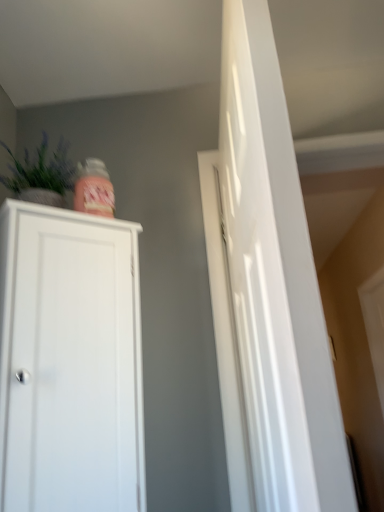
Describe the element at coordinates (41, 172) in the screenshot. I see `green matte vase at upper left` at that location.

Where is `green matte vase at upper left`? The width and height of the screenshot is (384, 512). green matte vase at upper left is located at coordinates (41, 172).

Identify the location of white matte cabinet at left. The width and height of the screenshot is (384, 512). (70, 362).

Describe the element at coordinates (70, 362) in the screenshot. The height and width of the screenshot is (512, 384). I see `white matte cabinet at left` at that location.

Image resolution: width=384 pixels, height=512 pixels. What do you see at coordinates (267, 291) in the screenshot? I see `glossy white door at right` at bounding box center [267, 291].

Identify the location of green matte vase at upper left. The image size is (384, 512). (41, 172).

Is white matte cabinet at left next to glossy white door at right and touching it?

No, white matte cabinet at left is not touching glossy white door at right.

From the picture: Can you confirm if white matte cabinet at left is smaller than glossy white door at right?

Indeed, white matte cabinet at left has a smaller size compared to glossy white door at right.

Is white matte cabinet at left further to the viewer compared to glossy white door at right?

Yes, white matte cabinet at left is further from the camera.

Between white matte cabinet at left and glossy white door at right, which one appears on the right side from the viewer's perspective?

glossy white door at right.

Considering the relative sizes of green matte vase at upper left and white matte cabinet at left in the image provided, is green matte vase at upper left smaller than white matte cabinet at left?

Indeed, green matte vase at upper left has a smaller size compared to white matte cabinet at left.

Is green matte vase at upper left facing away from white matte cabinet at left?

No, green matte vase at upper left's orientation is not away from white matte cabinet at left.

From the image's perspective, between green matte vase at upper left and white matte cabinet at left, who is located below?

white matte cabinet at left appears lower in the image.

Does green matte vase at upper left appear on the right side of white matte cabinet at left?

No, green matte vase at upper left is not to the right of white matte cabinet at left.

Which object is positioned more to the right, green matte vase at upper left or glossy white door at right?

Positioned to the right is glossy white door at right.

Does green matte vase at upper left touch glossy white door at right?

There is a gap between green matte vase at upper left and glossy white door at right.

From the image's perspective, who appears lower, green matte vase at upper left or glossy white door at right?

From the image's view, glossy white door at right is below.

Is point (80, 348) positioned behind point (67, 158)?

No, (80, 348) is closer to viewer.

Considering the relative positions of white matte cabinet at left and green matte vase at upper left in the image provided, is white matte cabinet at left behind green matte vase at upper left?

No, white matte cabinet at left is in front of green matte vase at upper left.

Could you tell me if white matte cabinet at left is facing green matte vase at upper left?

No.

Which of these two, white matte cabinet at left or green matte vase at upper left, stands taller?

With more height is white matte cabinet at left.

Is glossy white door at right with white matte cabinet at left?

No, glossy white door at right is not in contact with white matte cabinet at left.

From a real-world perspective, is glossy white door at right physically located above or below white matte cabinet at left?

From a real-world perspective, glossy white door at right is physically above white matte cabinet at left.

Is glossy white door at right facing towards white matte cabinet at left?

Yes, glossy white door at right is oriented towards white matte cabinet at left.

This screenshot has width=384, height=512. I want to click on plant behind the glossy white door at right, so click(41, 172).

Considering the positions of objects glossy white door at right and green matte vase at upper left in the image provided, who is more to the right, glossy white door at right or green matte vase at upper left?

From the viewer's perspective, glossy white door at right appears more on the right side.

From a real-world perspective, is glossy white door at right physically below green matte vase at upper left?

Indeed, from a real-world perspective, glossy white door at right is positioned beneath green matte vase at upper left.

From the image's perspective, is glossy white door at right on green matte vase at upper left?

No.

Where is `cupboard below the glossy white door at right (from a real-world perspective)`? The width and height of the screenshot is (384, 512). cupboard below the glossy white door at right (from a real-world perspective) is located at coordinates (70, 362).

You are a GUI agent. You are given a task and a screenshot of the screen. Output one action in this format:
    pyautogui.click(x=<x>, y=<y>)
    Task: Click on the cupboard that is in front of the green matte vase at upper left
    This screenshot has height=512, width=384.
    Given the screenshot: What is the action you would take?
    pyautogui.click(x=70, y=362)

From the image, which object appears to be nearer to green matte vase at upper left, white matte cabinet at left or glossy white door at right?

Among the two, white matte cabinet at left is located nearer to green matte vase at upper left.

Consider the image. Based on their spatial positions, is green matte vase at upper left or glossy white door at right closer to white matte cabinet at left?

green matte vase at upper left is positioned closer to the anchor white matte cabinet at left.

From the picture: Considering their positions, is glossy white door at right positioned further to green matte vase at upper left than white matte cabinet at left?

glossy white door at right lies further to green matte vase at upper left than the other object.

Looking at the image, which one is located further to white matte cabinet at left, glossy white door at right or green matte vase at upper left?

The object further to white matte cabinet at left is glossy white door at right.

Which object lies further to the anchor point glossy white door at right, green matte vase at upper left or white matte cabinet at left?

Based on the image, green matte vase at upper left appears to be further to glossy white door at right.

When comparing their distances from glossy white door at right, does white matte cabinet at left or green matte vase at upper left seem further?

green matte vase at upper left is further to glossy white door at right.

Where is `cupboard located between glossy white door at right and green matte vase at upper left in the depth direction`? cupboard located between glossy white door at right and green matte vase at upper left in the depth direction is located at coordinates (70, 362).